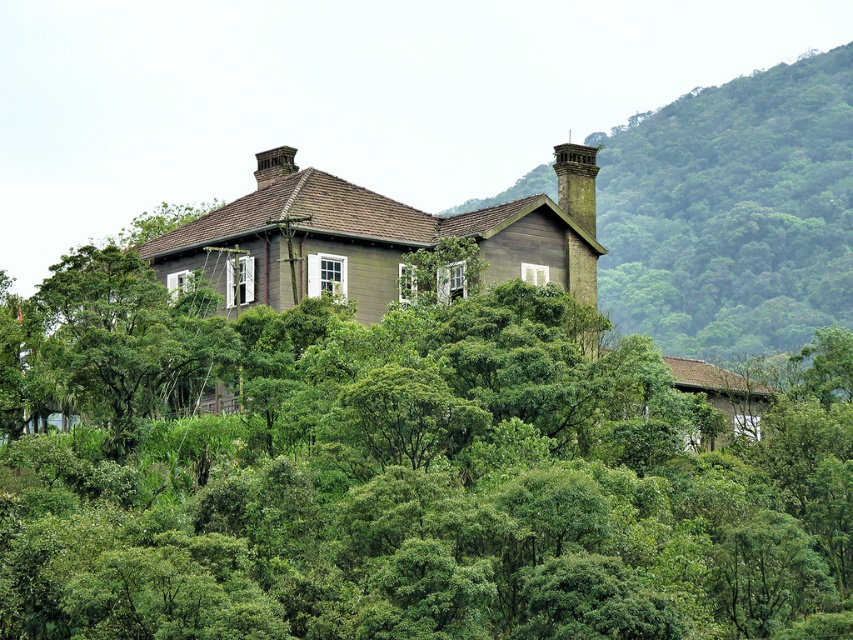
Is green leafy tree at center in front of rustic stone chimney at upper right?

Yes, green leafy tree at center is closer to the viewer.

Does green leafy tree at center appear under rustic stone chimney at upper right?

Yes.

At what (x,y) coordinates should I click in order to perform the action: click on green leafy tree at center. Please return your answer as a coordinate pair (x, y). Looking at the image, I should click on (440, 490).

Measure the distance from wooden house at center to rustic stone chimney at upper right.

122.09 meters

Who is positioned more to the left, wooden house at center or rustic stone chimney at upper right?

From the viewer's perspective, rustic stone chimney at upper right appears more on the left side.

Where is `wooden house at center`? This screenshot has height=640, width=853. wooden house at center is located at coordinates (732, 211).

From the picture: Is green leafy tree at center wider than wooden house at center?

No.

Which is more to the right, green leafy tree at center or wooden house at center?

From the viewer's perspective, wooden house at center appears more on the right side.

What do you see at coordinates (440, 490) in the screenshot? I see `green leafy tree at center` at bounding box center [440, 490].

The width and height of the screenshot is (853, 640). Find the location of `green leafy tree at center`. green leafy tree at center is located at coordinates (440, 490).